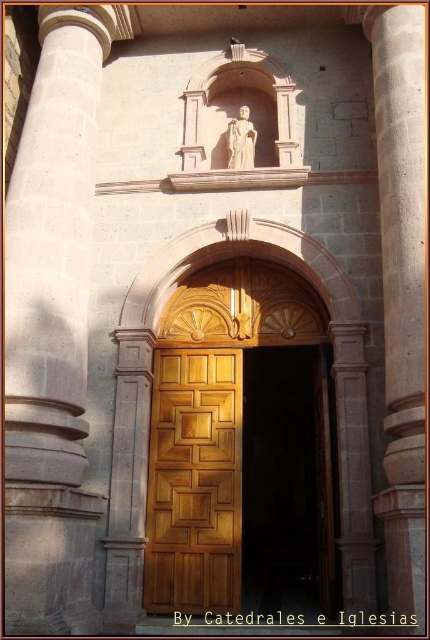
You are standing at the entrance of the church and want to locate the polished wood door at center. According to the coordinates provided, where exactly is the door positioned in the image?

The polished wood door at center is positioned at the coordinates point [194,483].

You are standing at the entrance of the church and want to take a photo. There are two points marked in the image, point 1 at coordinates point (x=418, y=627) and point 2 at point (x=227, y=134). Which point is closer to your camera lens?

Point (x=418, y=627) is closer to the camera than point (x=227, y=134).

You are an architect designing a new church entrance. You need to choose between the wooden door at center and the polished wood door at center. The space allocated for the door is 3 meters wide. Which door should you select based on their sizes?

The wooden door at center has a larger width than the polished wood door at center. Since the allocated space is 3 meters wide, you should choose the wooden door at center to ensure it fits properly.